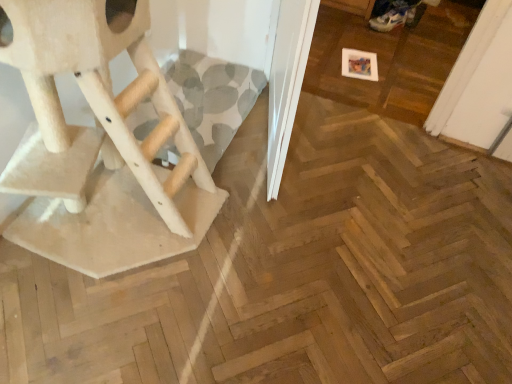
Question: Should I look upward or downward to see beige carpeted cat tree at left?

Choices:
 (A) down
 (B) up

Answer: (B)